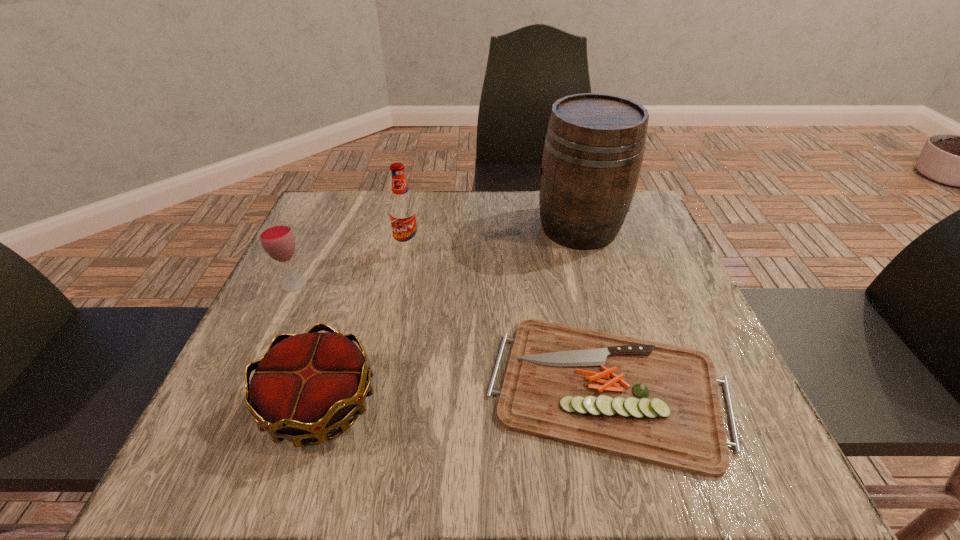
Locate an element on the screen. The image size is (960, 540). vacant space situated 0.280m on the front of the wineglass is located at coordinates (236, 410).

Where is `blank area located on the right of the second shortest object`? Image resolution: width=960 pixels, height=540 pixels. blank area located on the right of the second shortest object is located at coordinates (506, 403).

Where is `vacant area situated on the left of the chopping board`? vacant area situated on the left of the chopping board is located at coordinates (287, 389).

At what (x,y) coordinates should I click in order to perform the action: click on cider present at the far edge. Please return your answer as a coordinate pair (x, y). The width and height of the screenshot is (960, 540). Looking at the image, I should click on (594, 145).

Where is `root beer present at the far edge`? This screenshot has height=540, width=960. root beer present at the far edge is located at coordinates (x=403, y=214).

The image size is (960, 540). I want to click on crown present at the near edge, so click(306, 385).

Identify the location of chopping board that is positioned at the near edge. (657, 403).

Where is `wineglass at the left edge`? This screenshot has width=960, height=540. wineglass at the left edge is located at coordinates (277, 238).

Where is `crown that is at the left edge`? crown that is at the left edge is located at coordinates (306, 385).

The height and width of the screenshot is (540, 960). Find the location of `cider positioned at the right edge`. cider positioned at the right edge is located at coordinates (594, 145).